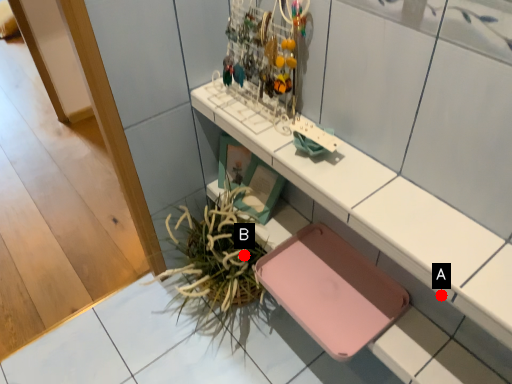
Question: Two points are circled on the image, labeled by A and B beside each circle. Which of the following is the closest to the observer?

Choices:
 (A) A is closer
 (B) B is closer

Answer: (A)